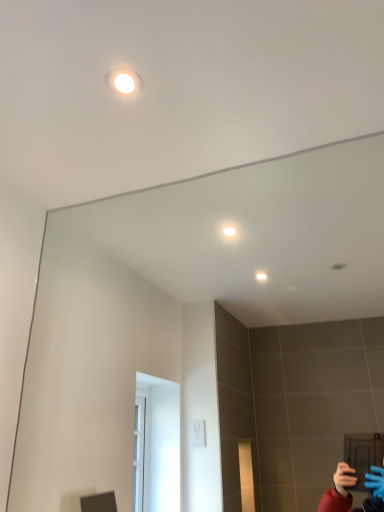
Question: Is the depth of transparent glass mirror at upper center less than that of white glossy light at upper center?

Choices:
 (A) yes
 (B) no

Answer: (A)

Question: Can you confirm if transparent glass mirror at upper center is thinner than white glossy light at upper center?

Choices:
 (A) no
 (B) yes

Answer: (B)

Question: Does transparent glass mirror at upper center have a smaller size compared to white glossy light at upper center?

Choices:
 (A) yes
 (B) no

Answer: (B)

Question: From a real-world perspective, is transparent glass mirror at upper center on top of white glossy light at upper center?

Choices:
 (A) no
 (B) yes

Answer: (A)

Question: From the image's perspective, is transparent glass mirror at upper center below white glossy light at upper center?

Choices:
 (A) yes
 (B) no

Answer: (A)

Question: Is transparent glass mirror at upper center not within white glossy light at upper center?

Choices:
 (A) yes
 (B) no

Answer: (A)

Question: Can we say white glossy light at upper center lies outside transparent glass mirror at upper center?

Choices:
 (A) no
 (B) yes

Answer: (B)

Question: Is white glossy light at upper center aimed at transparent glass mirror at upper center?

Choices:
 (A) yes
 (B) no

Answer: (B)

Question: Can you confirm if white glossy light at upper center is positioned to the right of transparent glass mirror at upper center?

Choices:
 (A) no
 (B) yes

Answer: (A)

Question: Considering the relative sizes of white glossy light at upper center and transparent glass mirror at upper center in the image provided, is white glossy light at upper center smaller than transparent glass mirror at upper center?

Choices:
 (A) no
 (B) yes

Answer: (B)

Question: From the image's perspective, is white glossy light at upper center on top of transparent glass mirror at upper center?

Choices:
 (A) yes
 (B) no

Answer: (A)

Question: Is white glossy light at upper center further to the viewer compared to transparent glass mirror at upper center?

Choices:
 (A) no
 (B) yes

Answer: (B)

Question: Is transparent glass mirror at upper center situated inside white glossy light at upper center or outside?

Choices:
 (A) outside
 (B) inside

Answer: (A)